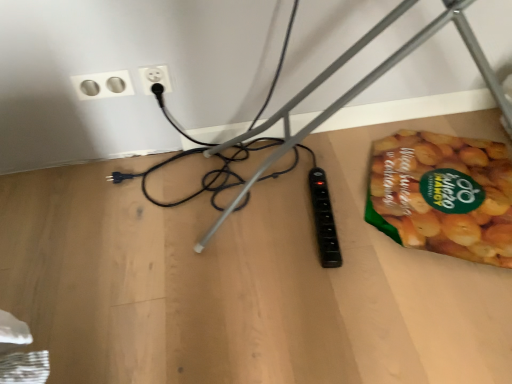
Where is `black plastic wire at lower right`? The image size is (512, 384). black plastic wire at lower right is located at coordinates (361, 89).

Measure the distance between point [143,74] and camera.

Point [143,74] is 3.92 feet from camera.

Measure the distance between point (108, 74) and camera.

A distance of 3.86 feet exists between point (108, 74) and camera.

In order to face silver metallic socket at upper left, positioned as the 2th power plugs and sockets in right-to-left order, should I rotate leftwards or rightwards?

A 19.782 degree turn to the left will do.

Measure the distance between green matte snack packet at lower right and camera.

green matte snack packet at lower right is 1.08 meters from camera.

I want to click on wooden table at lower right, so click(x=245, y=280).

Find the location of a particular element. The image size is (512, 384). black plastic wire at lower right is located at coordinates (361, 89).

In terms of height, does black plastic wire at lower right look taller or shorter compared to white plastic socket at upper center, positioned as the first power plugs and sockets in right-to-left order?

Clearly, black plastic wire at lower right is taller compared to white plastic socket at upper center, positioned as the first power plugs and sockets in right-to-left order.

From the image's perspective, which power plugs and sockets is the 2nd one above the black plastic wire at lower right? Please provide its 2D coordinates.

[(155, 78)]

From the picture: Is black plastic wire at lower right situated inside white plastic socket at upper center, positioned as the first power plugs and sockets in right-to-left order, or outside?

black plastic wire at lower right is spatially situated outside white plastic socket at upper center, positioned as the first power plugs and sockets in right-to-left order.

From a real-world perspective, is black plastic wire at lower right under white plastic socket at upper center, the 2th power plugs and sockets positioned from the left?

Incorrect, from a real-world perspective, black plastic wire at lower right is higher than white plastic socket at upper center, the 2th power plugs and sockets positioned from the left.

Image resolution: width=512 pixels, height=384 pixels. What are the coordinates of `the 1st power plugs and sockets to the left of the green matte snack packet at lower right, starting your count from the anchor` in the screenshot? It's located at (155, 78).

Is green matte snack packet at lower right shorter than white plastic socket at upper center, the 2th power plugs and sockets positioned from the left?

Indeed, green matte snack packet at lower right has a lesser height compared to white plastic socket at upper center, the 2th power plugs and sockets positioned from the left.

Can you confirm if green matte snack packet at lower right is thinner than white plastic socket at upper center, the 2th power plugs and sockets positioned from the left?

No, green matte snack packet at lower right is not thinner than white plastic socket at upper center, the 2th power plugs and sockets positioned from the left.

Is silver metallic socket at upper left, marked as the first power plugs and sockets in a left-to-right arrangement, not inside green matte snack packet at lower right?

Yes, silver metallic socket at upper left, marked as the first power plugs and sockets in a left-to-right arrangement, is outside of green matte snack packet at lower right.

Is point (92, 76) in front of point (378, 192)?

Yes.

Is silver metallic socket at upper left, marked as the first power plugs and sockets in a left-to-right arrangement, wider or thinner than green matte snack packet at lower right?

In the image, silver metallic socket at upper left, marked as the first power plugs and sockets in a left-to-right arrangement, appears to be more narrow than green matte snack packet at lower right.

Looking at the image, does silver metallic socket at upper left, positioned as the 2th power plugs and sockets in right-to-left order, seem bigger or smaller compared to green matte snack packet at lower right?

silver metallic socket at upper left, positioned as the 2th power plugs and sockets in right-to-left order, is smaller than green matte snack packet at lower right.

Which point is more distant from viewer, (105, 77) or (55, 224)?

The point (55, 224) is behind.

From a real-world perspective, relative to wooden table at lower right, is silver metallic socket at upper left, positioned as the 2th power plugs and sockets in right-to-left order, vertically above or below?

From a real-world perspective, silver metallic socket at upper left, positioned as the 2th power plugs and sockets in right-to-left order, is physically above wooden table at lower right.

Between silver metallic socket at upper left, positioned as the 2th power plugs and sockets in right-to-left order, and wooden table at lower right, which one has less height?

wooden table at lower right is shorter.

Would you say wooden table at lower right contains green matte snack packet at lower right?

No, wooden table at lower right does not contain green matte snack packet at lower right.

Considering the sizes of wooden table at lower right and green matte snack packet at lower right in the image, is wooden table at lower right wider or thinner than green matte snack packet at lower right?

In the image, wooden table at lower right appears to be wider than green matte snack packet at lower right.

Is wooden table at lower right shorter than green matte snack packet at lower right?

Yes, wooden table at lower right is shorter than green matte snack packet at lower right.

From the image's perspective, starting from the wooden table at lower right, which power plugs and sockets is the 2nd one above? Please provide its 2D coordinates.

[(155, 78)]

How much distance is there between wooden table at lower right and white plastic socket at upper center, the 2th power plugs and sockets positioned from the left?

23.65 inches.

Between wooden table at lower right and white plastic socket at upper center, positioned as the first power plugs and sockets in right-to-left order, which one has larger width?

wooden table at lower right.

From the image's perspective, would you say wooden table at lower right is shown under white plastic socket at upper center, positioned as the first power plugs and sockets in right-to-left order?

Correct, wooden table at lower right appears lower than white plastic socket at upper center, positioned as the first power plugs and sockets in right-to-left order, in the image.

How far apart are wooden table at lower right and black plastic wire at lower right?

A distance of 11.38 inches exists between wooden table at lower right and black plastic wire at lower right.

Which object is closer to the camera taking this photo, wooden table at lower right or black plastic wire at lower right?

black plastic wire at lower right is more forward.

Considering the sizes of wooden table at lower right and black plastic wire at lower right in the image, is wooden table at lower right wider or thinner than black plastic wire at lower right?

Clearly, wooden table at lower right has more width compared to black plastic wire at lower right.

There is a white plastic socket at upper center, the 2th power plugs and sockets positioned from the left. What are the coordinates of `wire above it (from a real-world perspective)` in the screenshot? It's located at (361, 89).

Starting from the green matte snack packet at lower right, which power plugs and sockets is the 1st one to the left? Please provide its 2D coordinates.

[(155, 78)]

Which object lies nearer to the anchor point white plastic socket at upper center, the 2th power plugs and sockets positioned from the left, black plastic wire at lower right or silver metallic socket at upper left, marked as the first power plugs and sockets in a left-to-right arrangement?

silver metallic socket at upper left, marked as the first power plugs and sockets in a left-to-right arrangement.

Considering their positions, is silver metallic socket at upper left, positioned as the 2th power plugs and sockets in right-to-left order, positioned further to wooden table at lower right than black plastic wire at lower right?

silver metallic socket at upper left, positioned as the 2th power plugs and sockets in right-to-left order, is further to wooden table at lower right.

Looking at the image, which one is located closer to black plastic wire at lower right, silver metallic socket at upper left, marked as the first power plugs and sockets in a left-to-right arrangement, or white plastic socket at upper center, the 2th power plugs and sockets positioned from the left?

Based on the image, white plastic socket at upper center, the 2th power plugs and sockets positioned from the left, appears to be nearer to black plastic wire at lower right.

Based on the photo, estimate the real-world distances between objects in this image. Which object is closer to wooden table at lower right, black plastic wire at lower right or silver metallic socket at upper left, marked as the first power plugs and sockets in a left-to-right arrangement?

The object closer to wooden table at lower right is black plastic wire at lower right.

When comparing their distances from silver metallic socket at upper left, marked as the first power plugs and sockets in a left-to-right arrangement, does black plastic wire at lower right or green matte snack packet at lower right seem further?

Among the two, green matte snack packet at lower right is located further to silver metallic socket at upper left, marked as the first power plugs and sockets in a left-to-right arrangement.

Based on their spatial positions, is wooden table at lower right or black plastic wire at lower right further from silver metallic socket at upper left, positioned as the 2th power plugs and sockets in right-to-left order?

Among the two, wooden table at lower right is located further to silver metallic socket at upper left, positioned as the 2th power plugs and sockets in right-to-left order.

Estimate the real-world distances between objects in this image. Which object is closer to black plastic wire at lower right, white plastic socket at upper center, positioned as the first power plugs and sockets in right-to-left order, or wooden table at lower right?

wooden table at lower right is closer to black plastic wire at lower right.

Which object lies further to the anchor point white plastic socket at upper center, positioned as the first power plugs and sockets in right-to-left order, silver metallic socket at upper left, marked as the first power plugs and sockets in a left-to-right arrangement, or black plastic wire at lower right?

black plastic wire at lower right is further to white plastic socket at upper center, positioned as the first power plugs and sockets in right-to-left order.

What are the coordinates of `power plugs and sockets located between silver metallic socket at upper left, positioned as the 2th power plugs and sockets in right-to-left order, and wooden table at lower right in the left-right direction` in the screenshot? It's located at (155, 78).

Find the location of a particular element. This screenshot has height=384, width=512. table top between black plastic wire at lower right and white plastic socket at upper center, the 2th power plugs and sockets positioned from the left, along the z-axis is located at coordinates (245, 280).

I want to click on power plugs and sockets between black plastic wire at lower right and white plastic socket at upper center, the 2th power plugs and sockets positioned from the left, from front to back, so click(103, 85).

At what (x,y) coordinates should I click in order to perform the action: click on wire situated between silver metallic socket at upper left, marked as the first power plugs and sockets in a left-to-right arrangement, and green matte snack packet at lower right from left to right. Please return your answer as a coordinate pair (x, y). Looking at the image, I should click on (361, 89).